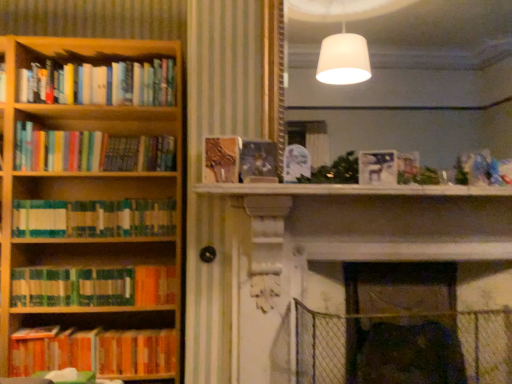
How much space does orange matte bookshelf at lower left, the 6th book in the top-to-bottom sequence, occupy vertically?

orange matte bookshelf at lower left, the 6th book in the top-to-bottom sequence, is 8.27 inches tall.

At what (x,y) coordinates should I click in order to perform the action: click on green matte bookshelf at left, the 2th book ordered from the bottom. Please return your answer as a coordinate pair (x, y). Looking at the image, I should click on (93, 286).

The image size is (512, 384). What do you see at coordinates (91, 188) in the screenshot?
I see `wooden bookcase at left` at bounding box center [91, 188].

At what (x,y) coordinates should I click in order to perform the action: click on velvet dark brown swivel chair at lower right. Please return your answer as a coordinate pair (x, y). Image resolution: width=512 pixels, height=384 pixels. Looking at the image, I should click on (409, 354).

Can you confirm if multicolored paperbacks at left, which appears as the fifth book when ordered from the bottom, is positioned to the left of velvet dark brown swivel chair at lower right?

Indeed, multicolored paperbacks at left, which appears as the fifth book when ordered from the bottom, is positioned on the left side of velvet dark brown swivel chair at lower right.

Is multicolored paperbacks at left, the 2th book in the top-to-bottom sequence, positioned with its back to velvet dark brown swivel chair at lower right?

That's not correct — multicolored paperbacks at left, the 2th book in the top-to-bottom sequence, is not looking away from velvet dark brown swivel chair at lower right.

Is multicolored paperbacks at left, which appears as the fifth book when ordered from the bottom, thinner than velvet dark brown swivel chair at lower right?

Yes, multicolored paperbacks at left, which appears as the fifth book when ordered from the bottom, is thinner than velvet dark brown swivel chair at lower right.

From a real-world perspective, is multicolored paperbacks at left, the 2th book in the top-to-bottom sequence, physically located above or below velvet dark brown swivel chair at lower right?

In terms of real-world spatial position, multicolored paperbacks at left, the 2th book in the top-to-bottom sequence, is above velvet dark brown swivel chair at lower right.

How many degrees apart are the facing directions of white matte paper at upper center and green matte bookshelf at left, the 2th book ordered from the bottom?

0.87 degrees separate the facing orientations of white matte paper at upper center and green matte bookshelf at left, the 2th book ordered from the bottom.

From the picture: Does white matte paper at upper center have a lesser width compared to green matte bookshelf at left, positioned as the 5th book in top-to-bottom order?

Yes.

Is white matte paper at upper center far away from green matte bookshelf at left, positioned as the 5th book in top-to-bottom order?

Yes.

What are the coordinates of `the 2nd book below the white matte paper at upper center (from the image's perspective)` in the screenshot? It's located at (93, 286).

Is wooden bookcase at left facing towards multicolored paperbacks at left, which appears as the fifth book when ordered from the bottom?

Yes, wooden bookcase at left is turned towards multicolored paperbacks at left, which appears as the fifth book when ordered from the bottom.

Is wooden bookcase at left positioned before multicolored paperbacks at left, which appears as the fifth book when ordered from the bottom?

Yes, it is.

Is point (61, 239) farther from camera compared to point (113, 140)?

No, it is not.

Considering the sizes of wooden bookcase at left and multicolored paperbacks at left, which appears as the fifth book when ordered from the bottom, in the image, is wooden bookcase at left wider or thinner than multicolored paperbacks at left, which appears as the fifth book when ordered from the bottom,?

Considering their sizes, wooden bookcase at left looks broader than multicolored paperbacks at left, which appears as the fifth book when ordered from the bottom.

Considering the positions of point (40, 92) and point (135, 113), is point (40, 92) closer or farther from the camera than point (135, 113)?

Point (40, 92).

Could you tell me if hardcover books at left, which ranks as the 6th book in bottom-to-top order, is turned towards wooden bookcase at left?

Yes, hardcover books at left, which ranks as the 6th book in bottom-to-top order, is facing wooden bookcase at left.

In terms of size, does hardcover books at left, which is the 1th book in top-to-bottom order, appear bigger or smaller than wooden bookcase at left?

Considering their sizes, hardcover books at left, which is the 1th book in top-to-bottom order, takes up less space than wooden bookcase at left.

Considering the sizes of hardcover books at left, which is the 1th book in top-to-bottom order, and wooden bookcase at left in the image, is hardcover books at left, which is the 1th book in top-to-bottom order, wider or thinner than wooden bookcase at left?

In the image, hardcover books at left, which is the 1th book in top-to-bottom order, appears to be more narrow than wooden bookcase at left.

From a real-world perspective, between orange matte bookshelf at lower left, the 6th book in the top-to-bottom sequence, and shiny metallic book at center, the 4th book from the bottom, who is vertically higher?

shiny metallic book at center, the 4th book from the bottom, is physically above.

Consider the image. Could you tell me if orange matte bookshelf at lower left, the first book in the bottom-to-top sequence, is turned towards shiny metallic book at center, the 4th book from the bottom?

No, orange matte bookshelf at lower left, the first book in the bottom-to-top sequence, is not oriented towards shiny metallic book at center, the 4th book from the bottom.

Is orange matte bookshelf at lower left, the first book in the bottom-to-top sequence, to the left or to the right of shiny metallic book at center, the 4th book from the bottom, in the image?

From the image, it's evident that orange matte bookshelf at lower left, the first book in the bottom-to-top sequence, is to the left of shiny metallic book at center, the 4th book from the bottom.

Considering the positions of point (47, 340) and point (260, 161), is point (47, 340) closer or farther from the camera than point (260, 161)?

Clearly, point (47, 340) is more distant from the camera than point (260, 161).

Between green matte bookshelf at left, the 3th book ordered from the bottom, and hardcover books at left, which is the 1th book in top-to-bottom order, which one appears on the right side from the viewer's perspective?

Positioned to the right is green matte bookshelf at left, the 3th book ordered from the bottom.

Which is correct: green matte bookshelf at left, the 3th book ordered from the bottom, is inside hardcover books at left, which ranks as the 6th book in bottom-to-top order, or outside of it?

green matte bookshelf at left, the 3th book ordered from the bottom, is not inside hardcover books at left, which ranks as the 6th book in bottom-to-top order, it's outside.

This screenshot has width=512, height=384. There is a hardcover books at left, which is the 1th book in top-to-bottom order. In order to click on the 3rd book below it (from the image's perspective) in this screenshot , I will do `click(93, 218)`.

Which object is thinner, green matte bookshelf at left, which is the 4th book in top-to-bottom order, or hardcover books at left, which ranks as the 6th book in bottom-to-top order?

hardcover books at left, which ranks as the 6th book in bottom-to-top order.

Measure the distance from green matte bookshelf at left, positioned as the 5th book in top-to-bottom order, to hardcover books at left, which is the 1th book in top-to-bottom order.

The distance of green matte bookshelf at left, positioned as the 5th book in top-to-bottom order, from hardcover books at left, which is the 1th book in top-to-bottom order, is 35.84 inches.

Consider the image. Who is bigger, green matte bookshelf at left, positioned as the 5th book in top-to-bottom order, or hardcover books at left, which is the 1th book in top-to-bottom order?

A: Bigger between the two is green matte bookshelf at left, positioned as the 5th book in top-to-bottom order.

From a real-world perspective, between green matte bookshelf at left, the 2th book ordered from the bottom, and hardcover books at left, which ranks as the 6th book in bottom-to-top order, who is vertically lower?

In real-world perspective, green matte bookshelf at left, the 2th book ordered from the bottom, is lower.

Is green matte bookshelf at left, the 2th book ordered from the bottom, to the left of hardcover books at left, which is the 1th book in top-to-bottom order, from the viewer's perspective?

No.

The image size is (512, 384). There is a velvet dark brown swivel chair at lower right. What are the coordinates of `the 5th book above it (from a real-world perspective)` in the screenshot? It's located at (90, 151).

At what (x,y) coordinates should I click in order to perform the action: click on paperback book on the right of green matte bookshelf at left, positioned as the 5th book in top-to-bottom order. Please return your answer as a coordinate pair (x, y). This screenshot has width=512, height=384. Looking at the image, I should click on (377, 167).

From the image, which object appears to be farther from green matte bookshelf at left, the 2th book ordered from the bottom, shiny metallic book at center, the third book from the top, or wooden bookcase at left?

shiny metallic book at center, the third book from the top, is further to green matte bookshelf at left, the 2th book ordered from the bottom.

Considering their positions, is green matte bookshelf at left, positioned as the 5th book in top-to-bottom order, positioned further to white matte paper at upper center than shiny metallic book at center, the 4th book from the bottom?

green matte bookshelf at left, positioned as the 5th book in top-to-bottom order, lies further to white matte paper at upper center than the other object.

Considering their positions, is white matte paper at upper center positioned further to wooden bookcase at left than hardcover books at left, which is the 1th book in top-to-bottom order?

white matte paper at upper center is positioned further to the anchor wooden bookcase at left.

Looking at the image, which one is located further to velvet dark brown swivel chair at lower right, multicolored paperbacks at left, the 2th book in the top-to-bottom sequence, or hardcover books at left, which is the 1th book in top-to-bottom order?

Based on the image, hardcover books at left, which is the 1th book in top-to-bottom order, appears to be further to velvet dark brown swivel chair at lower right.

Consider the image. From the image, which object appears to be farther from green matte bookshelf at left, positioned as the 5th book in top-to-bottom order, orange matte bookshelf at lower left, the 6th book in the top-to-bottom sequence, or green matte bookshelf at left, the 3th book ordered from the bottom?

The object further to green matte bookshelf at left, positioned as the 5th book in top-to-bottom order, is green matte bookshelf at left, the 3th book ordered from the bottom.

Based on their spatial positions, is white matte paper at upper center or wooden bookcase at left further from velvet dark brown swivel chair at lower right?

wooden bookcase at left is further to velvet dark brown swivel chair at lower right.

Looking at this image, looking at the image, which one is located closer to green matte bookshelf at left, which is the 4th book in top-to-bottom order, multicolored paperbacks at left, which appears as the fifth book when ordered from the bottom, or shiny metallic book at center, the 4th book from the bottom?

multicolored paperbacks at left, which appears as the fifth book when ordered from the bottom, is closer to green matte bookshelf at left, which is the 4th book in top-to-bottom order.

Considering their positions, is shiny metallic book at center, the 4th book from the bottom, positioned further to green matte bookshelf at left, which is the 4th book in top-to-bottom order, than wooden bookcase at left?

The object further to green matte bookshelf at left, which is the 4th book in top-to-bottom order, is shiny metallic book at center, the 4th book from the bottom.

You are a GUI agent. You are given a task and a screenshot of the screen. Output one action in this format:
    pyautogui.click(x=<x>, y=<y>)
    Task: Click on the bookcase between green matte bookshelf at left, the 3th book ordered from the bottom, and orange matte bookshelf at lower left, the first book in the bottom-to-top sequence, from top to bottom
    
    Given the screenshot: What is the action you would take?
    pyautogui.click(x=91, y=188)

I want to click on bookcase between hardcover books at left, which ranks as the 6th book in bottom-to-top order, and green matte bookshelf at left, the 2th book ordered from the bottom, vertically, so click(x=91, y=188).

Find the location of a particular element. Image resolution: width=512 pixels, height=384 pixels. paperback book between hardcover books at left, which ranks as the 6th book in bottom-to-top order, and velvet dark brown swivel chair at lower right is located at coordinates (377, 167).

Locate an element on the screen. paperback book situated between green matte bookshelf at left, the 2th book ordered from the bottom, and velvet dark brown swivel chair at lower right from left to right is located at coordinates (377, 167).